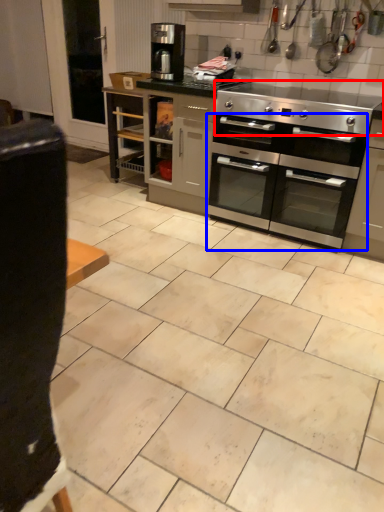
Question: Which of the following is the farthest to the observer, gas stove (highlighted by a red box) or oven (highlighted by a blue box)?

Choices:
 (A) gas stove
 (B) oven

Answer: (B)